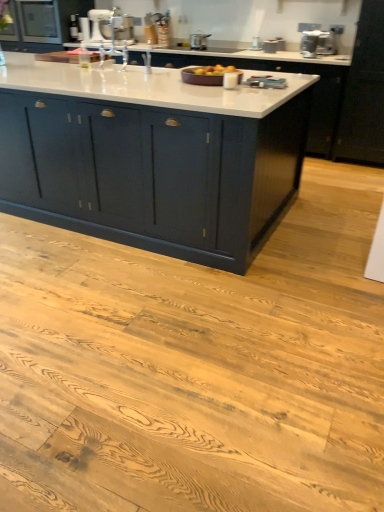
Question: Does satin silver pot at upper center, which is the third appliance from back to front, have a lesser height compared to metallic silver toaster at upper center, the third appliance positioned from the left?

Choices:
 (A) yes
 (B) no

Answer: (B)

Question: From a real-world perspective, is satin silver pot at upper center, which is counted as the 3th appliance, starting from the front, under metallic silver toaster at upper center, the 2th appliance in the back-to-front sequence?

Choices:
 (A) no
 (B) yes

Answer: (A)

Question: Would you say metallic silver toaster at upper center, the 2th appliance in the back-to-front sequence, is part of satin silver pot at upper center, the 4th appliance from the right,'s contents?

Choices:
 (A) yes
 (B) no

Answer: (B)

Question: Is satin silver pot at upper center, the 4th appliance from the right, far from metallic silver toaster at upper center, which ranks as the 4th appliance in front-to-back order?

Choices:
 (A) yes
 (B) no

Answer: (B)

Question: Is satin silver pot at upper center, which is counted as the 3th appliance, starting from the front, turned away from metallic silver toaster at upper center, which ranks as the 4th appliance in front-to-back order?

Choices:
 (A) yes
 (B) no

Answer: (B)

Question: From a real-world perspective, is satin silver pot at upper center, the 4th appliance from the right, over metallic silver toaster at upper center, which ranks as the 4th appliance in front-to-back order?

Choices:
 (A) no
 (B) yes

Answer: (B)

Question: Is satin silver pot at upper center, the 4th appliance from the right, located outside satin silver toaster at upper right, arranged as the first appliance when viewed from the right?

Choices:
 (A) no
 (B) yes

Answer: (B)

Question: Would you consider satin silver pot at upper center, the 4th appliance from the right, to be distant from satin silver toaster at upper right, arranged as the first appliance when viewed from the right?

Choices:
 (A) yes
 (B) no

Answer: (A)

Question: Is satin silver pot at upper center, which is the third appliance from back to front, facing away from satin silver toaster at upper right, which ranks as the second appliance in front-to-back order?

Choices:
 (A) no
 (B) yes

Answer: (A)

Question: Does satin silver pot at upper center, the 4th appliance from the right, have a greater height compared to satin silver toaster at upper right, arranged as the first appliance when viewed from the right?

Choices:
 (A) yes
 (B) no

Answer: (B)

Question: From the image's perspective, is satin silver pot at upper center, which is the third appliance from back to front, below satin silver toaster at upper right, which ranks as the second appliance in front-to-back order?

Choices:
 (A) yes
 (B) no

Answer: (B)

Question: From the image's perspective, would you say satin silver pot at upper center, which is counted as the 3th appliance, starting from the front, is positioned over satin silver toaster at upper right, arranged as the first appliance when viewed from the right?

Choices:
 (A) yes
 (B) no

Answer: (A)

Question: Considering the relative positions of matte black cabinet at upper left, marked as the 2th cabinetry in a front-to-back arrangement, and white glossy stand mixer at upper center, the first appliance when ordered from back to front, in the image provided, is matte black cabinet at upper left, marked as the 2th cabinetry in a front-to-back arrangement, to the right of white glossy stand mixer at upper center, the first appliance when ordered from back to front, from the viewer's perspective?

Choices:
 (A) yes
 (B) no

Answer: (B)